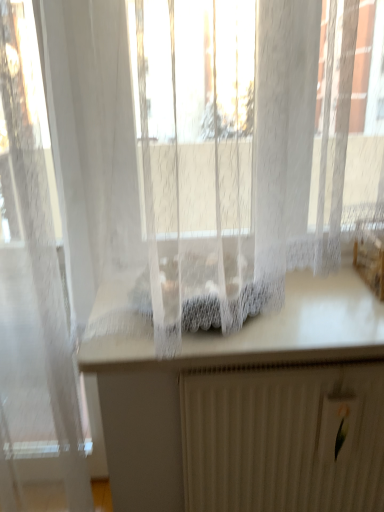
Question: From the image's perspective, is white lace curtain at center located above white matte radiator at lower center?

Choices:
 (A) yes
 (B) no

Answer: (A)

Question: Considering the relative sizes of white lace curtain at center and white matte radiator at lower center in the image provided, is white lace curtain at center taller than white matte radiator at lower center?

Choices:
 (A) yes
 (B) no

Answer: (B)

Question: Is the depth of white lace curtain at center greater than that of white matte radiator at lower center?

Choices:
 (A) no
 (B) yes

Answer: (A)

Question: Can you confirm if white lace curtain at center is shorter than white matte radiator at lower center?

Choices:
 (A) no
 (B) yes

Answer: (B)

Question: From the image's perspective, does white lace curtain at center appear lower than white matte radiator at lower center?

Choices:
 (A) yes
 (B) no

Answer: (B)

Question: Considering the relative sizes of white lace curtain at center and white matte radiator at lower center in the image provided, is white lace curtain at center thinner than white matte radiator at lower center?

Choices:
 (A) yes
 (B) no

Answer: (B)

Question: Can you confirm if white matte radiator at lower center is thinner than white lace curtain at center?

Choices:
 (A) yes
 (B) no

Answer: (A)

Question: Is white matte radiator at lower center wider than white lace curtain at center?

Choices:
 (A) no
 (B) yes

Answer: (A)

Question: From the image's perspective, does white matte radiator at lower center appear lower than white lace curtain at center?

Choices:
 (A) no
 (B) yes

Answer: (B)

Question: Is the position of white matte radiator at lower center more distant than that of white lace curtain at center?

Choices:
 (A) yes
 (B) no

Answer: (A)

Question: Is white matte radiator at lower center next to white lace curtain at center and touching it?

Choices:
 (A) yes
 (B) no

Answer: (B)

Question: Does white matte radiator at lower center have a lesser height compared to white lace curtain at center?

Choices:
 (A) no
 (B) yes

Answer: (A)

Question: Would you say white matte radiator at lower center is inside or outside white lace curtain at center?

Choices:
 (A) outside
 (B) inside

Answer: (A)